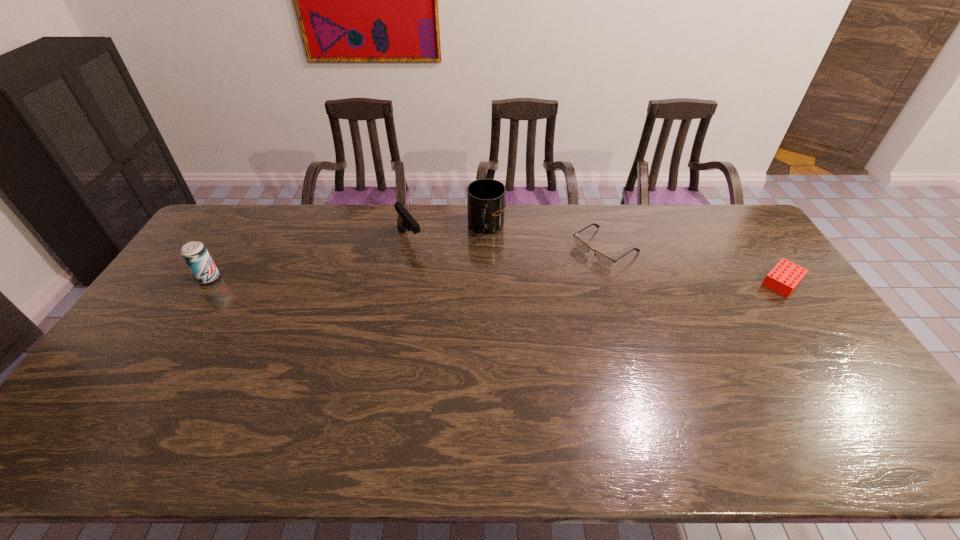
At what (x,y) coordinates should I click in order to perform the action: click on vacant point located between the beer can and the pistol. Please return your answer as a coordinate pair (x, y). The height and width of the screenshot is (540, 960). Looking at the image, I should click on (309, 258).

Image resolution: width=960 pixels, height=540 pixels. Find the location of `free space between the pistol and the beer can`. free space between the pistol and the beer can is located at coordinates (309, 258).

What are the coordinates of `free spot between the mug and the Lego` in the screenshot? It's located at (635, 254).

Where is `vacant space that's between the Lego and the third object from right to left`? This screenshot has width=960, height=540. vacant space that's between the Lego and the third object from right to left is located at coordinates (635, 254).

Where is `blank region between the mug and the Lego`? The height and width of the screenshot is (540, 960). blank region between the mug and the Lego is located at coordinates (635, 254).

The height and width of the screenshot is (540, 960). Identify the location of free point between the spectacles and the beer can. (407, 263).

Identify the location of free spot between the pistol and the fourth object from left to right. (508, 244).

The image size is (960, 540). What are the coordinates of `the closest object relative to the fourth object from left to right` in the screenshot? It's located at (486, 203).

Find the location of a particular element. object that is the second closest to the second object from right to left is located at coordinates pos(785,276).

Locate an element on the screen. Image resolution: width=960 pixels, height=540 pixels. vacant space that satisfies the following two spatial constraints: 1. on the back side of the beer can; 2. on the left side of the fourth object from left to right is located at coordinates (228, 248).